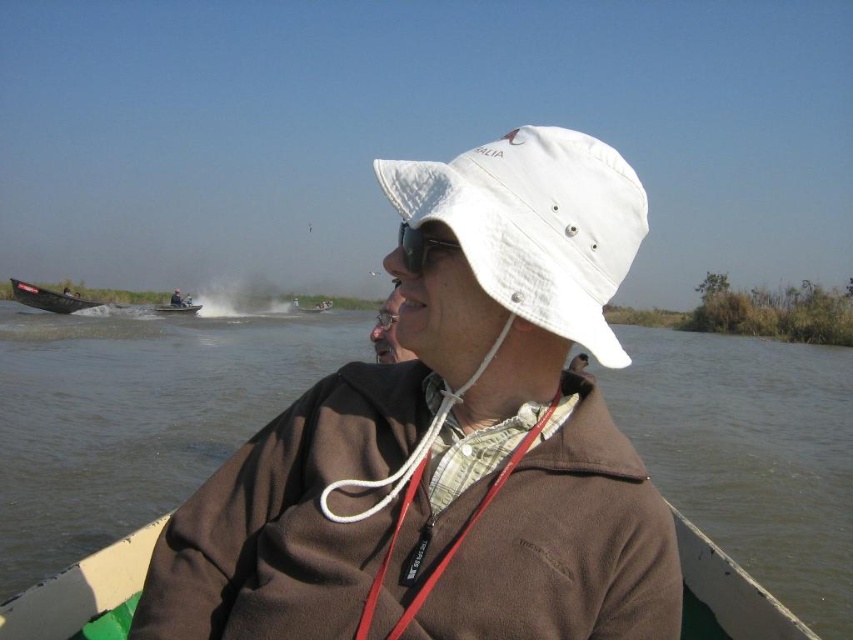
Question: Among these objects, which one is nearest to the camera?

Choices:
 (A) brown water at center
 (B) green plastic boat at center
 (C) brown fleece jacket at center
 (D) matte black goggles at center

Answer: (D)

Question: Does white fabric hat at center have a greater width compared to brown fleece boat at center?

Choices:
 (A) no
 (B) yes

Answer: (B)

Question: Which object is positioned farthest from the matte black goggles at center?

Choices:
 (A) white fabric hat at center
 (B) brown fleece boat at center

Answer: (B)

Question: Is brown water at center thinner than matte black goggles at center?

Choices:
 (A) yes
 (B) no

Answer: (B)

Question: Does brown water at center have a larger size compared to metallic gray boat at left?

Choices:
 (A) yes
 (B) no

Answer: (A)

Question: Which object is positioned farthest from the brown water at center?

Choices:
 (A) metallic gray boat at left
 (B) white matte hat at center
 (C) matte black boat at upper left

Answer: (A)